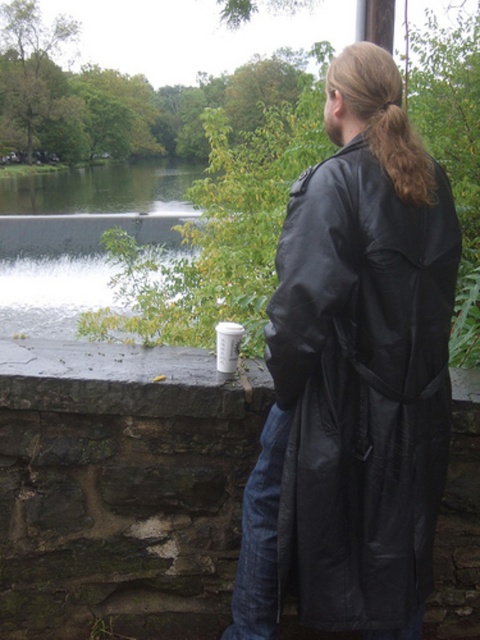
Question: Which object appears farthest from the camera in this image?

Choices:
 (A) brown silky hair at upper right
 (B) black leather jacket at upper right

Answer: (A)

Question: Does black leather jacket at upper right have a larger size compared to brown silky hair at upper right?

Choices:
 (A) no
 (B) yes

Answer: (B)

Question: In this image, where is black leather jacket at upper right located relative to brown silky hair at upper right?

Choices:
 (A) right
 (B) left

Answer: (B)

Question: From the image, what is the correct spatial relationship of black leather jacket at upper right in relation to brown silky hair at upper right?

Choices:
 (A) left
 (B) right

Answer: (A)

Question: Which point is closer to the camera?

Choices:
 (A) (376, 301)
 (B) (410, 193)

Answer: (A)